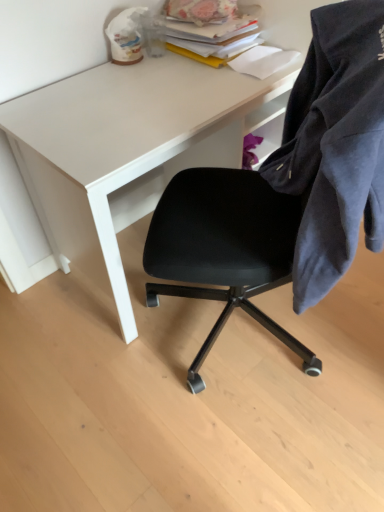
Locate an element on the screen. The width and height of the screenshot is (384, 512). free space above stacked paper at upper right (from a real-world perspective) is located at coordinates (204, 17).